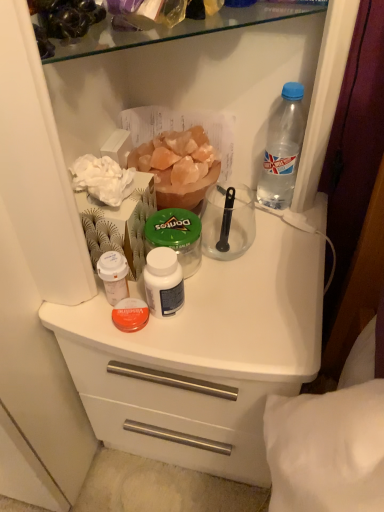
Where is `unoccupied space behind transparent plastic spoon at center`? This screenshot has width=384, height=512. unoccupied space behind transparent plastic spoon at center is located at coordinates pos(236,205).